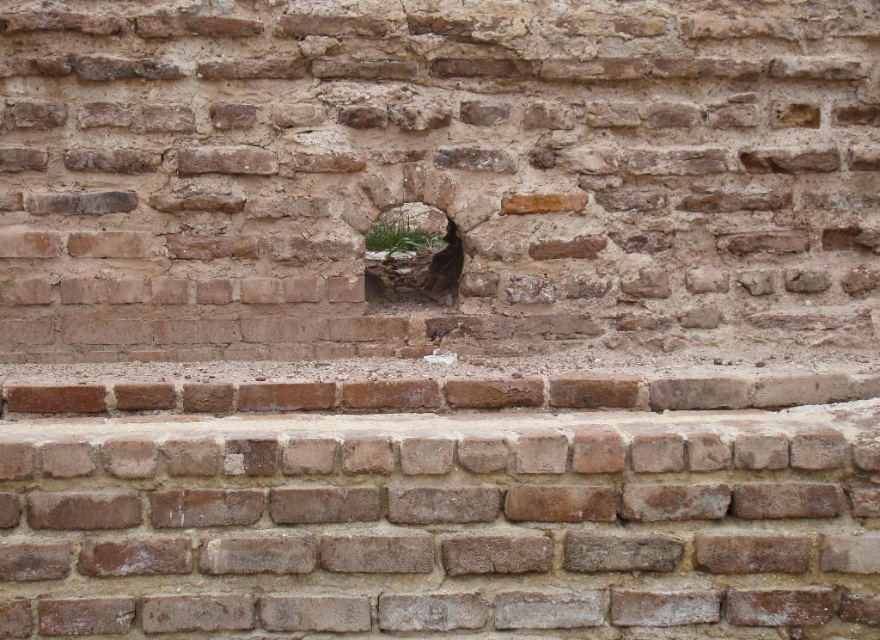
You are standing in front of a brick wall with a hole in the center. There is a point marked at coordinates [412,257]. Based on the scene, what is the color of the surface at that point?

The point at [412,257] is on green mossy rock at center, so the color is green.